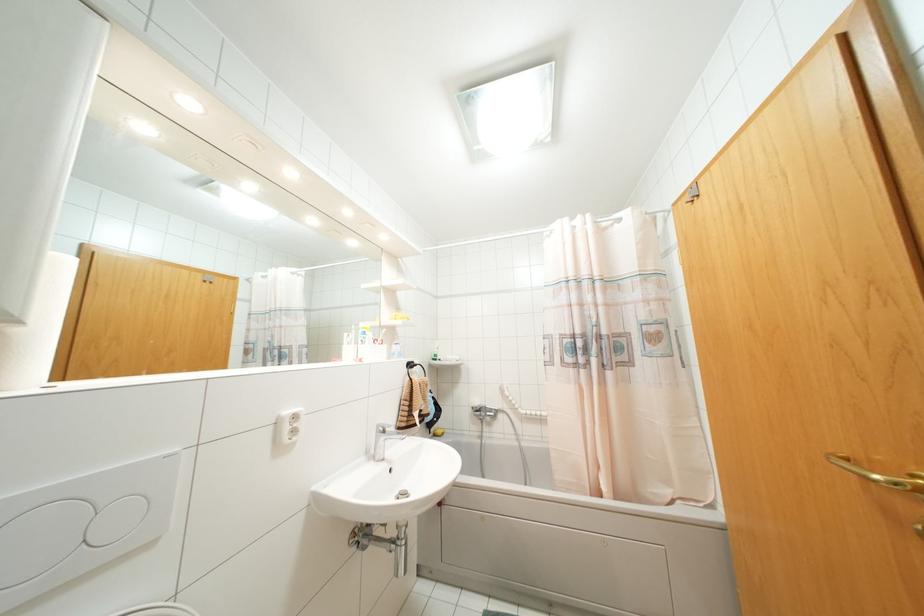
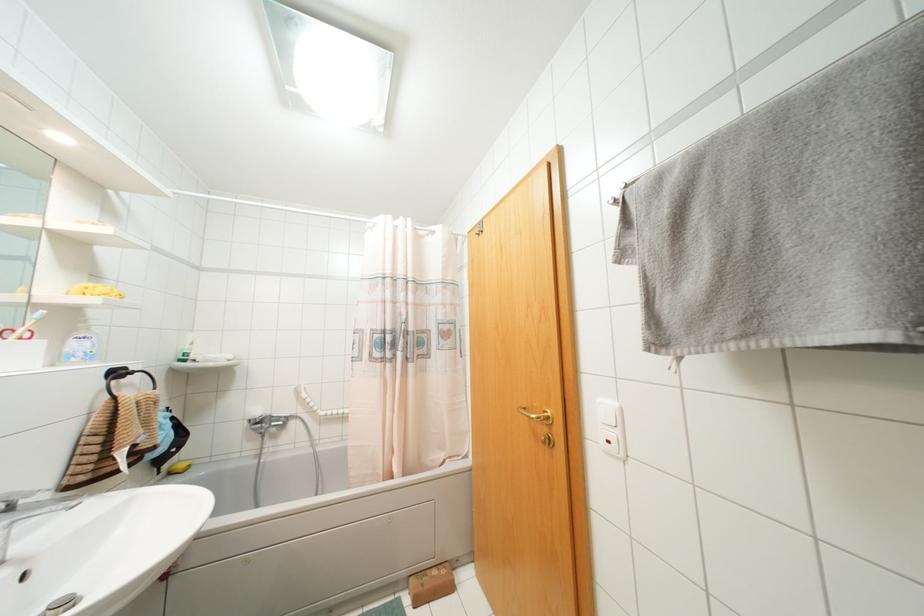
In the second image, find the point that corresponds to (x=383, y=329) in the first image.

(42, 310)